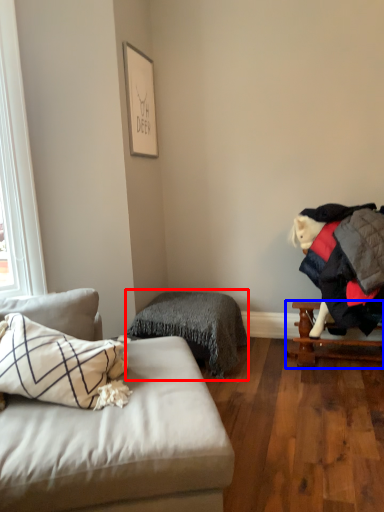
Question: Among these objects, which one is farthest to the camera, bedding (highlighted by a red box) or table (highlighted by a blue box)?

Choices:
 (A) bedding
 (B) table

Answer: (A)